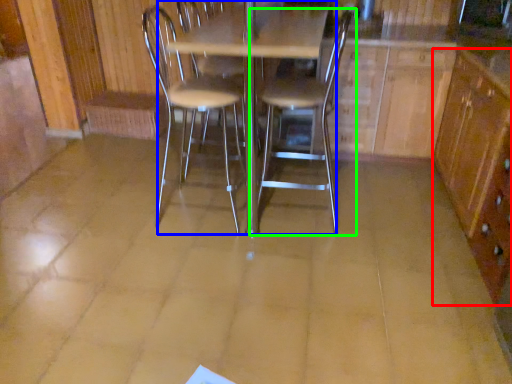
Question: Estimate the real-world distances between objects in this image. Which object is farther from file cabinet (highlighted by a red box), table (highlighted by a blue box) or chair (highlighted by a green box)?

Choices:
 (A) table
 (B) chair

Answer: (A)